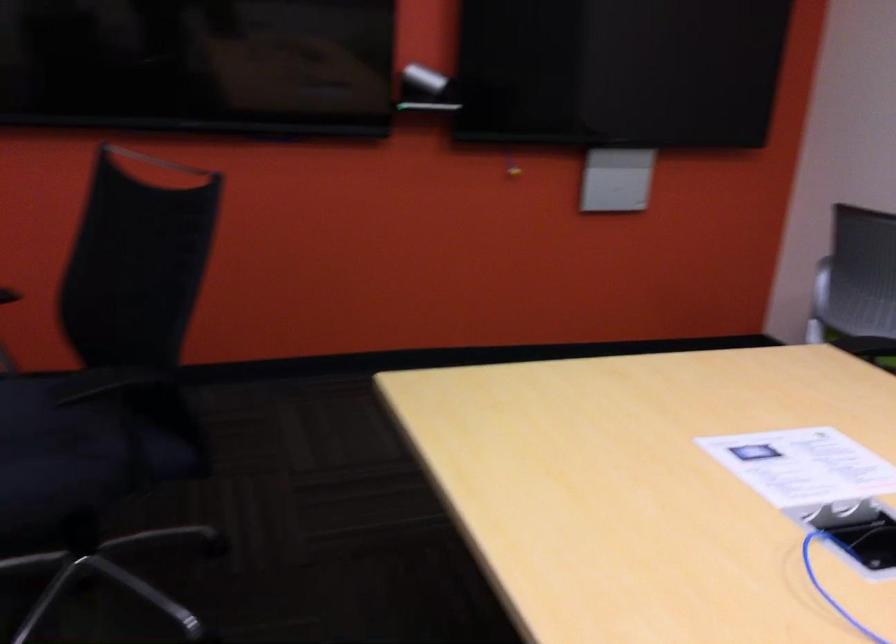
The height and width of the screenshot is (644, 896). I want to click on black smartphone, so click(858, 532).